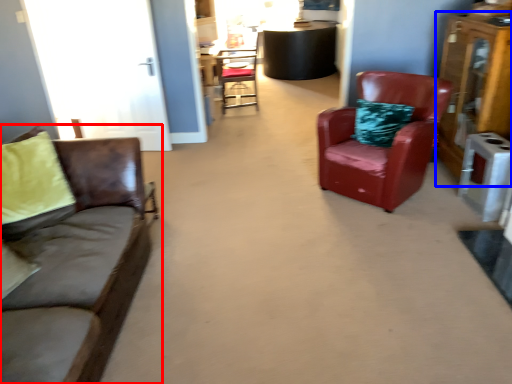
Question: Which point is closer to the camera, studio couch (highlighted by a red box) or dresser (highlighted by a blue box)?

Choices:
 (A) studio couch
 (B) dresser

Answer: (A)